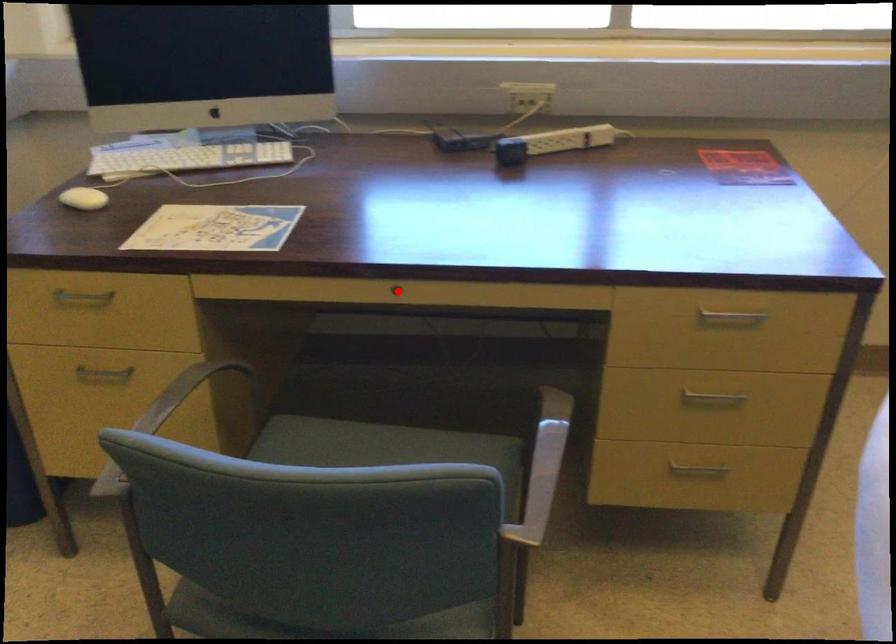
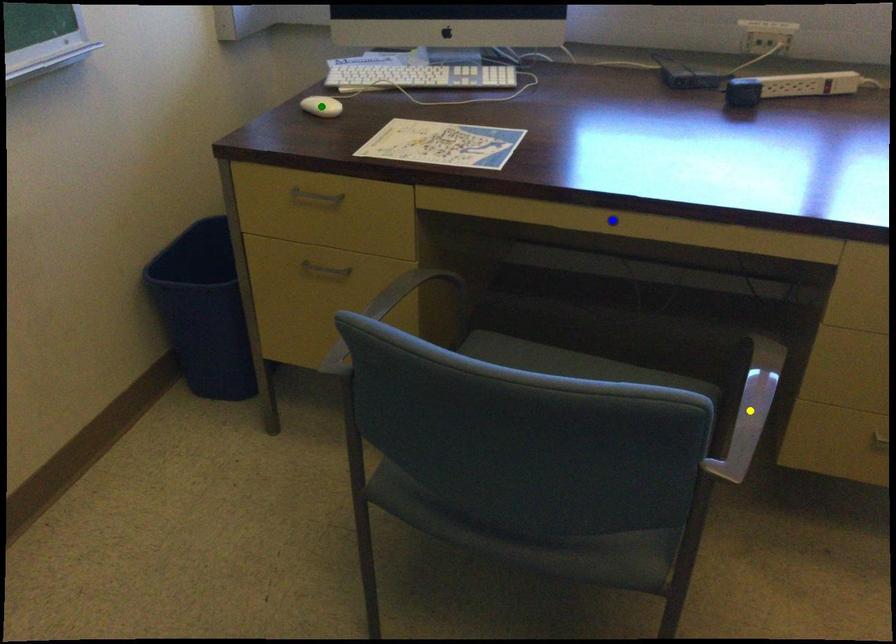
Question: I am providing you with two images of the same scene from different viewpoints. A red point is marked on the first image. You are given multiple points on the second image. Which mark in image 2 goes with the point in image 1?

Choices:
 (A) green point
 (B) yellow point
 (C) blue point

Answer: (C)